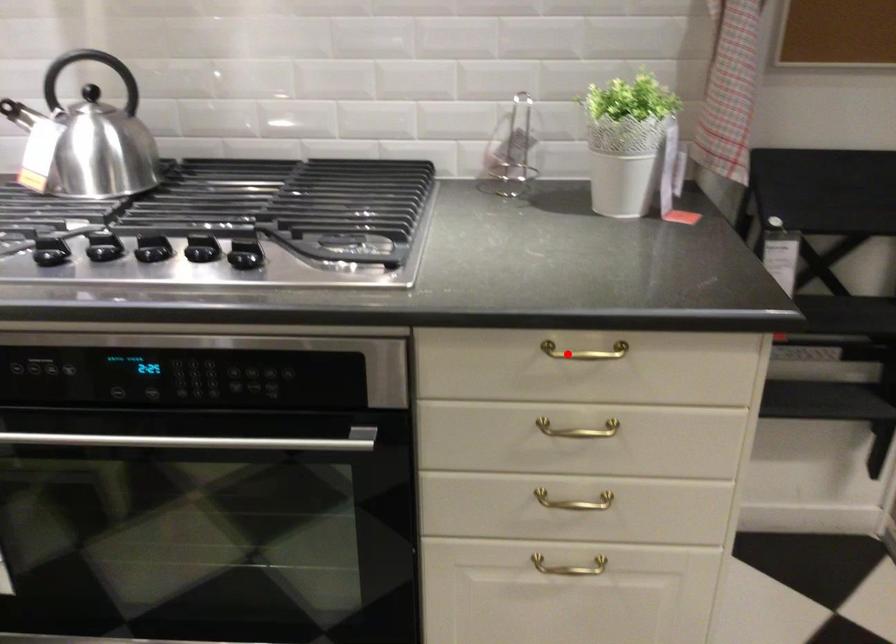
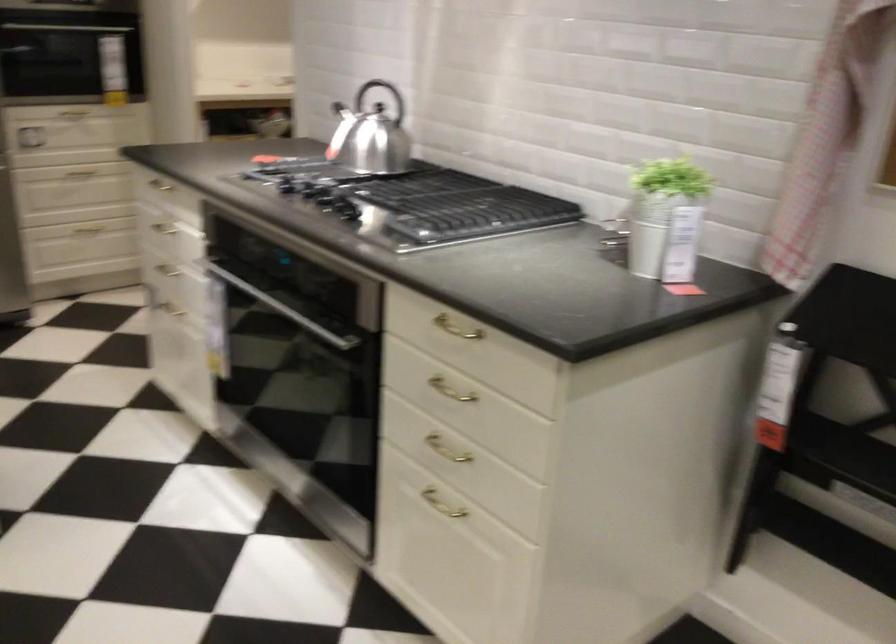
Find the pixel in the second image that matches the highlighted location in the first image.

(455, 328)